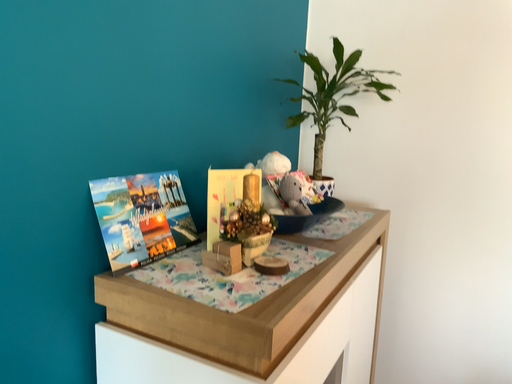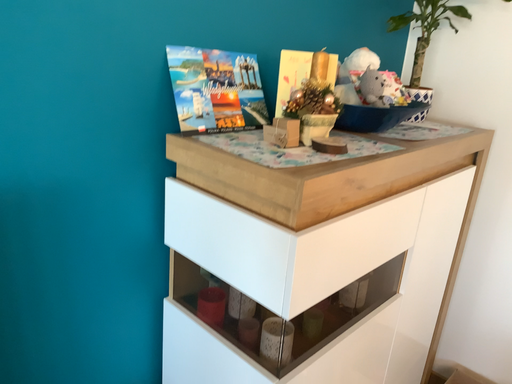
Question: How did the camera likely rotate when shooting the video?

Choices:
 (A) rotated downward
 (B) rotated upward

Answer: (A)